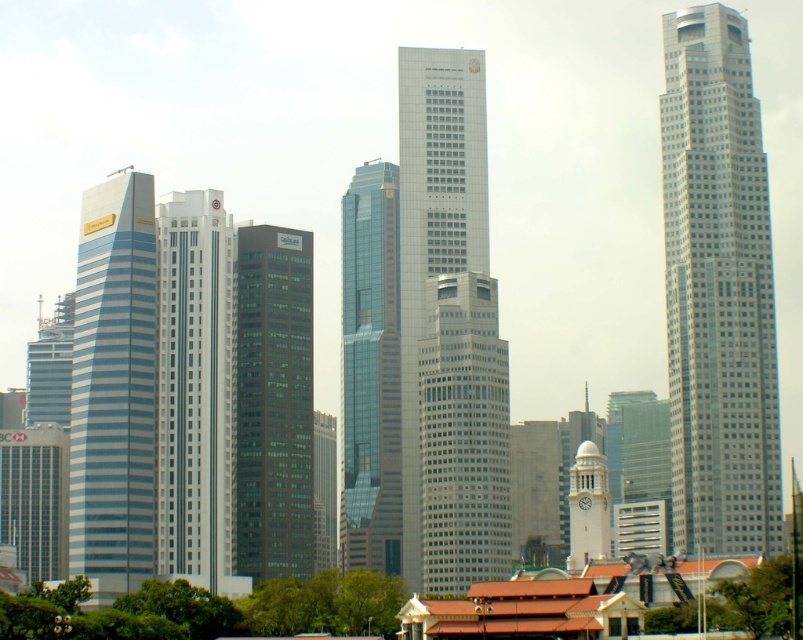
Question: Which is nearer to the blue glass skyscraper at left?

Choices:
 (A) glassy steel skyscraper at center
 (B) gray glass skyscraper at center

Answer: (B)

Question: Among these points, which one is farthest from the camera?

Choices:
 (A) (706, 264)
 (B) (437, 241)

Answer: (B)

Question: Among these points, which one is nearest to the camera?

Choices:
 (A) (496, 568)
 (B) (202, 490)
 (C) (357, 230)
 (D) (581, 496)

Answer: (B)

Question: Does silver glass skyscraper at right have a lesser width compared to glassy steel skyscraper at center?

Choices:
 (A) yes
 (B) no

Answer: (B)

Question: Can you confirm if gray glass skyscraper at center is thinner than glassy steel skyscraper at center?

Choices:
 (A) no
 (B) yes

Answer: (A)

Question: Does silver glass skyscraper at right have a smaller size compared to white stone clock tower at center?

Choices:
 (A) no
 (B) yes

Answer: (A)